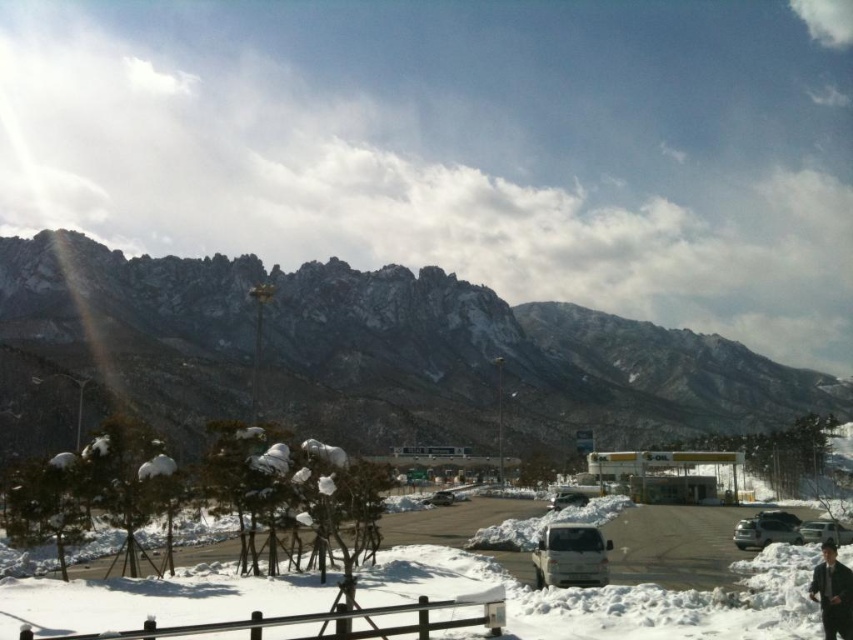
Question: Estimate the real-world distances between objects in this image. Which object is closer to the white matte suv at center?

Choices:
 (A) white fluffy snow at lower center
 (B) rocky gray mountain at upper left
 (C) dark blue leather jacket at lower right

Answer: (A)

Question: Can you confirm if white matte van at lower right is bigger than metallic silver sedan at center?

Choices:
 (A) no
 (B) yes

Answer: (B)

Question: Which object is positioned farthest from the rocky gray mountain at upper left?

Choices:
 (A) white matte suv at center
 (B) sleek silver sedan at center
 (C) white matte suv at lower right

Answer: (C)

Question: Is white fluffy snow at lower center positioned at the back of dark blue leather jacket at lower right?

Choices:
 (A) no
 (B) yes

Answer: (B)

Question: From the image, what is the correct spatial relationship of rocky gray mountain at upper left in relation to white matte suv at center?

Choices:
 (A) left
 (B) right

Answer: (B)

Question: Which of the following is the farthest from the observer?

Choices:
 (A) white matte van at lower right
 (B) metallic silver sedan at center
 (C) white matte suv at center
 (D) white matte suv at lower right

Answer: (B)